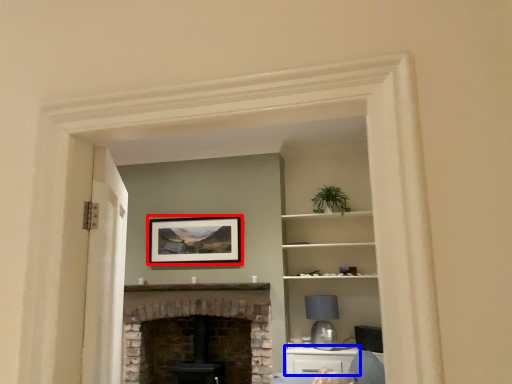
Question: Which object is closer to the camera taking this photo, picture frame (highlighted by a red box) or cabinetry (highlighted by a blue box)?

Choices:
 (A) picture frame
 (B) cabinetry

Answer: (B)